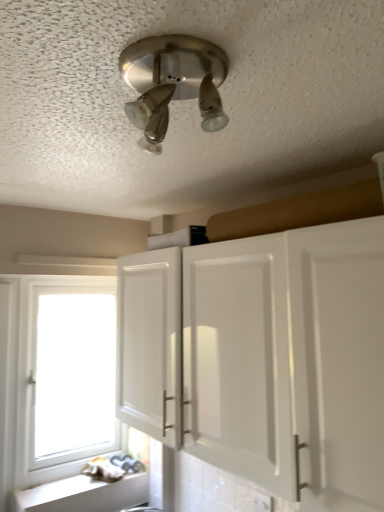
Question: In terms of height, does brushed metal light fixture at upper center look taller or shorter compared to white plastic electric outlet at lower center?

Choices:
 (A) tall
 (B) short

Answer: (A)

Question: From a real-world perspective, is brushed metal light fixture at upper center positioned above or below white plastic electric outlet at lower center?

Choices:
 (A) above
 (B) below

Answer: (A)

Question: Which is nearer to the white glossy cabinet at center?

Choices:
 (A) white plastic electric outlet at lower center
 (B) brushed metal light fixture at upper center
 (C) white wood window at lower left
 (D) white matte counter top at lower left

Answer: (A)

Question: Which object is the closest to the white glossy cabinet at center?

Choices:
 (A) white plastic electric outlet at lower center
 (B) white matte counter top at lower left
 (C) white wood window at lower left
 (D) brushed metal light fixture at upper center

Answer: (A)